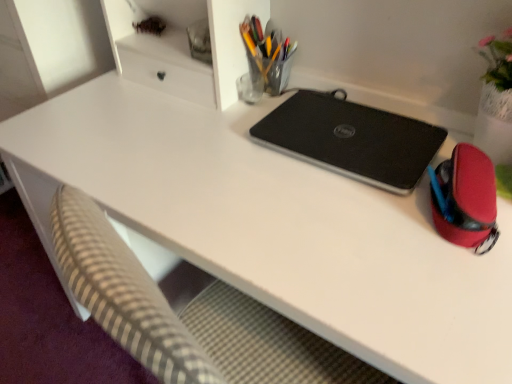
Question: Is rubberized red pouch at right, placed as the first stationery when sorted from bottom to top, oriented away from black matte laptop at center?

Choices:
 (A) yes
 (B) no

Answer: (B)

Question: Can you confirm if rubberized red pouch at right, which ranks as the second stationery in top-to-bottom order, is smaller than black matte laptop at center?

Choices:
 (A) yes
 (B) no

Answer: (A)

Question: Is rubberized red pouch at right, which is the 2th stationery in left-to-right order, closer to camera compared to black matte laptop at center?

Choices:
 (A) no
 (B) yes

Answer: (B)

Question: From the image's perspective, is rubberized red pouch at right, which is the second stationery in back-to-front order, beneath black matte laptop at center?

Choices:
 (A) yes
 (B) no

Answer: (A)

Question: Is rubberized red pouch at right, which is the 2th stationery in left-to-right order, to the left of black matte laptop at center from the viewer's perspective?

Choices:
 (A) no
 (B) yes

Answer: (A)

Question: Looking at the image, does black matte laptop at center seem bigger or smaller compared to translucent glass pen holder at upper center, marked as the second stationery in a right-to-left arrangement?

Choices:
 (A) small
 (B) big

Answer: (B)

Question: Would you say black matte laptop at center is to the left or to the right of translucent glass pen holder at upper center, arranged as the first stationery when viewed from the left, in the picture?

Choices:
 (A) left
 (B) right

Answer: (B)

Question: Is black matte laptop at center in front of or behind translucent glass pen holder at upper center, the 2th stationery in the front-to-back sequence, in the image?

Choices:
 (A) front
 (B) behind

Answer: (A)

Question: Is black matte laptop at center wider or thinner than translucent glass pen holder at upper center, positioned as the first stationery in back-to-front order?

Choices:
 (A) wide
 (B) thin

Answer: (A)

Question: From the image's perspective, relative to black matte laptop at center, is translucent glass pen holder at upper center, marked as the second stationery in a right-to-left arrangement, above or below?

Choices:
 (A) below
 (B) above

Answer: (B)

Question: Is translucent glass pen holder at upper center, positioned as the first stationery in back-to-front order, in front of or behind black matte laptop at center in the image?

Choices:
 (A) behind
 (B) front

Answer: (A)

Question: Do you think translucent glass pen holder at upper center, marked as the second stationery in a right-to-left arrangement, is within black matte laptop at center, or outside of it?

Choices:
 (A) inside
 (B) outside

Answer: (B)

Question: From their relative heights in the image, would you say translucent glass pen holder at upper center, which is the 1th stationery from top to bottom, is taller or shorter than black matte laptop at center?

Choices:
 (A) tall
 (B) short

Answer: (A)

Question: From the image's perspective, relative to rubberized red pouch at right, which ranks as the second stationery in top-to-bottom order, is black matte laptop at center above or below?

Choices:
 (A) above
 (B) below

Answer: (A)

Question: Based on their positions, is black matte laptop at center located to the left or right of rubberized red pouch at right, which is the second stationery in back-to-front order?

Choices:
 (A) left
 (B) right

Answer: (A)